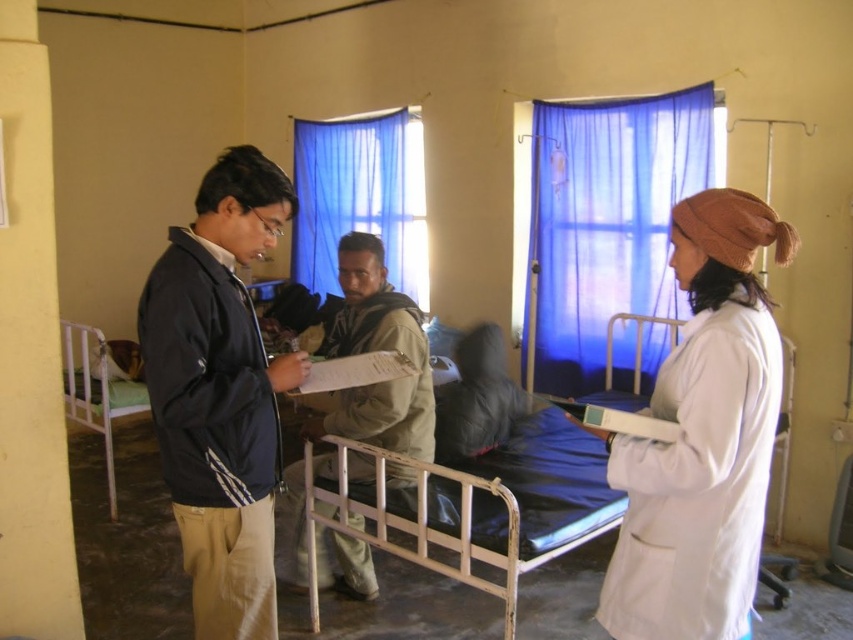
Question: Which is farther from the metallic hospital bed at left?

Choices:
 (A) khaki fabric jacket at center
 (B) metallic hospital bed at center
 (C) blue sheer curtain at upper center

Answer: (B)

Question: Does white matte lab coat at center appear on the right side of blue sheer curtain at center?

Choices:
 (A) yes
 (B) no

Answer: (B)

Question: Can you confirm if white matte lab coat at center is thinner than metallic hospital bed at left?

Choices:
 (A) no
 (B) yes

Answer: (B)

Question: Does white matte lab coat at center have a smaller size compared to blue sheer curtain at upper center?

Choices:
 (A) no
 (B) yes

Answer: (B)

Question: Which object is closer to the camera taking this photo?

Choices:
 (A) metallic hospital bed at left
 (B) metallic hospital bed at center

Answer: (B)

Question: Estimate the real-world distances between objects in this image. Which object is farther from the khaki fabric jacket at center?

Choices:
 (A) blue sheer curtain at center
 (B) blue sheer curtain at upper center
 (C) metallic hospital bed at left

Answer: (B)